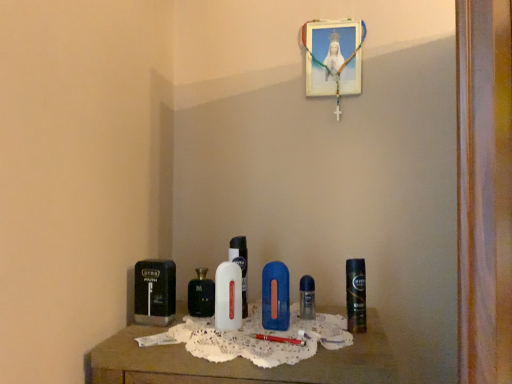
At what (x,y) coordinates should I click in order to perform the action: click on vacant position to the left of clear plastic perfume at center, which is the 2th perfume from back to front. Please return your answer as a coordinate pair (x, y). Image resolution: width=512 pixels, height=384 pixels. Looking at the image, I should click on (234, 326).